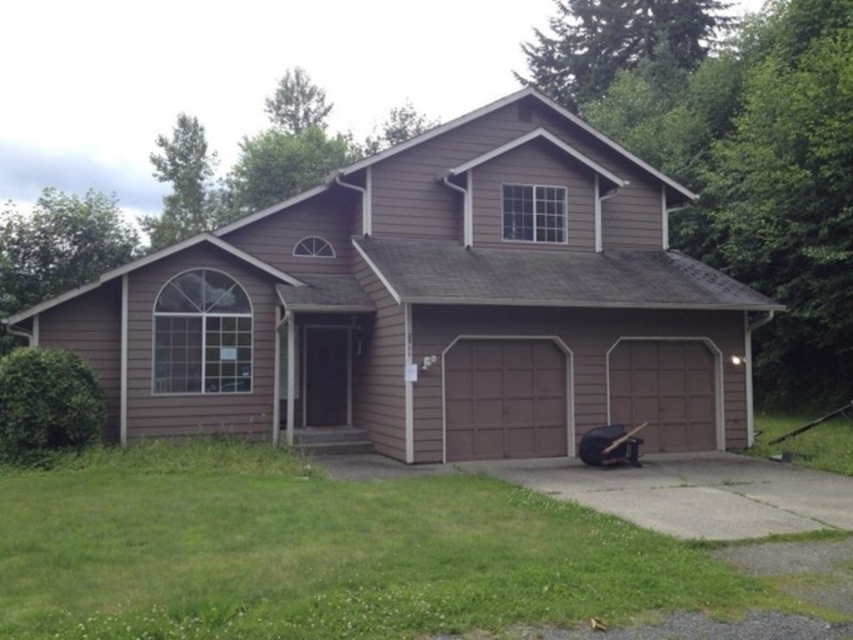
You are standing at the point with coordinates point (430, 305). Which object are you closest to?

The point (430, 305) corresponds to the brown wood garage at center, so you are closest to the brown wood garage at center.